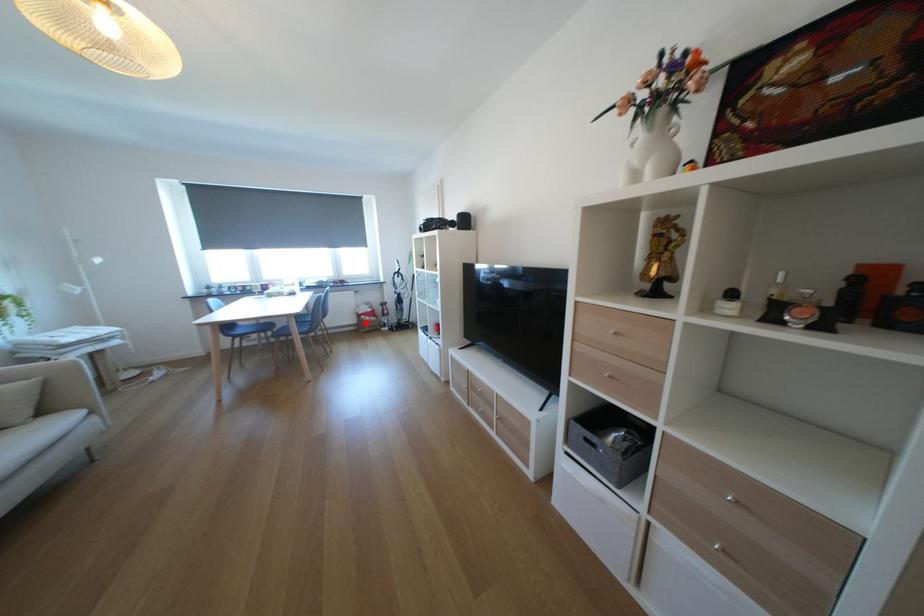
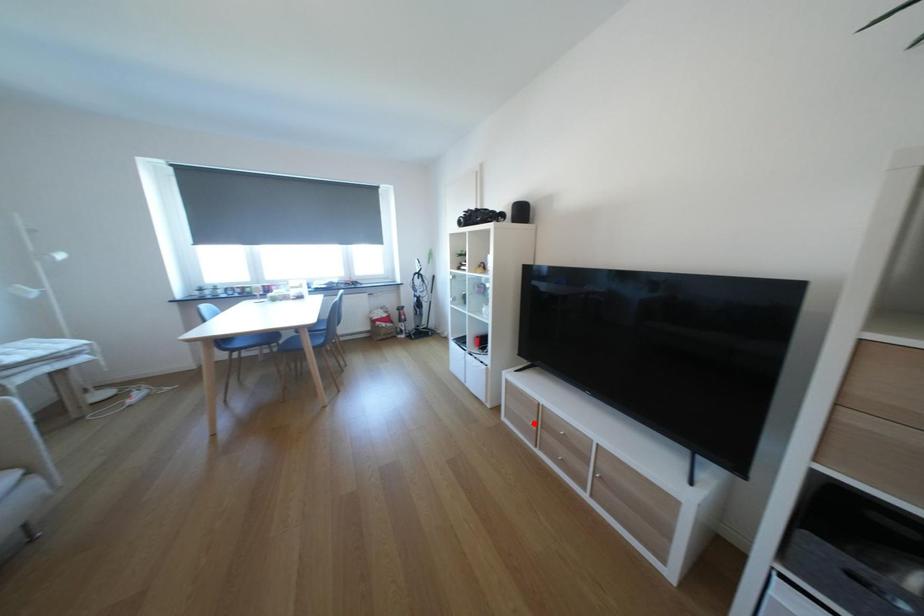
I am providing you with two images of the same scene from different viewpoints. A red point is marked on the first image and another point is marked on the second image. Does the point marked in image1 correspond to the same location as the one in image2?

No